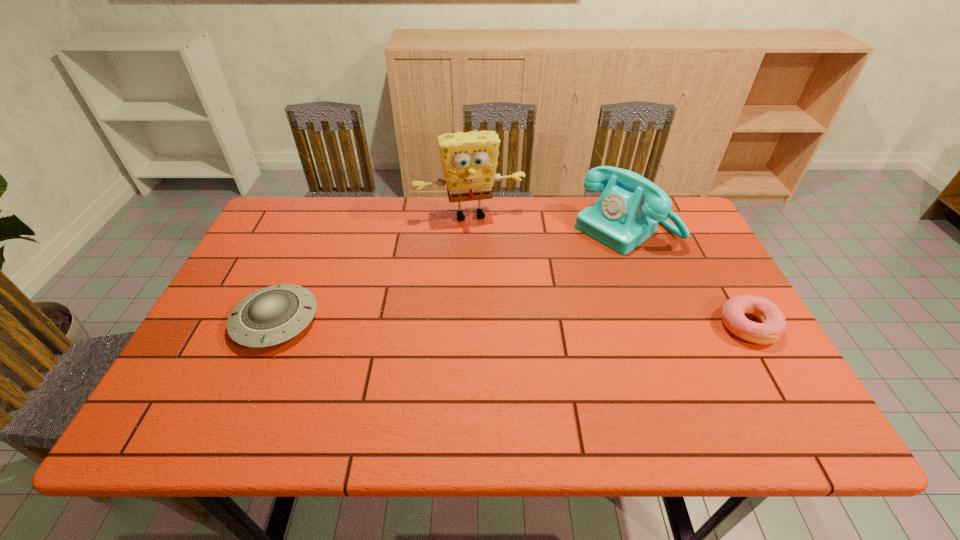
At what (x,y) coordinates should I click in order to perform the action: click on vacant space on the desktop that is between the saucer and the doughnut and is positioned on the face of the sponge. Please return your answer as a coordinate pair (x, y). The image size is (960, 540). Looking at the image, I should click on (497, 323).

The width and height of the screenshot is (960, 540). I want to click on vacant space on the desktop that is between the saucer and the doughnut and is positioned on the dial of the third shortest object, so click(492, 323).